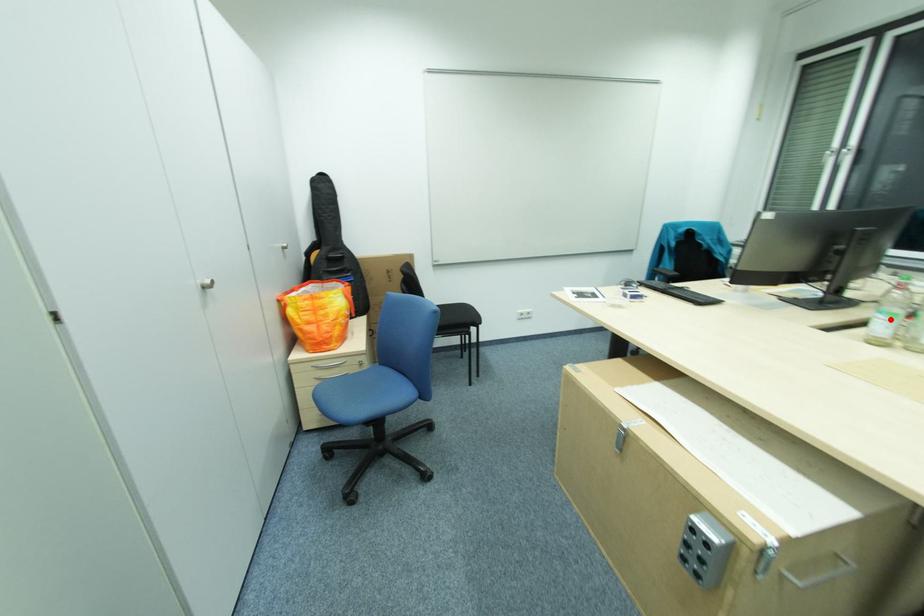
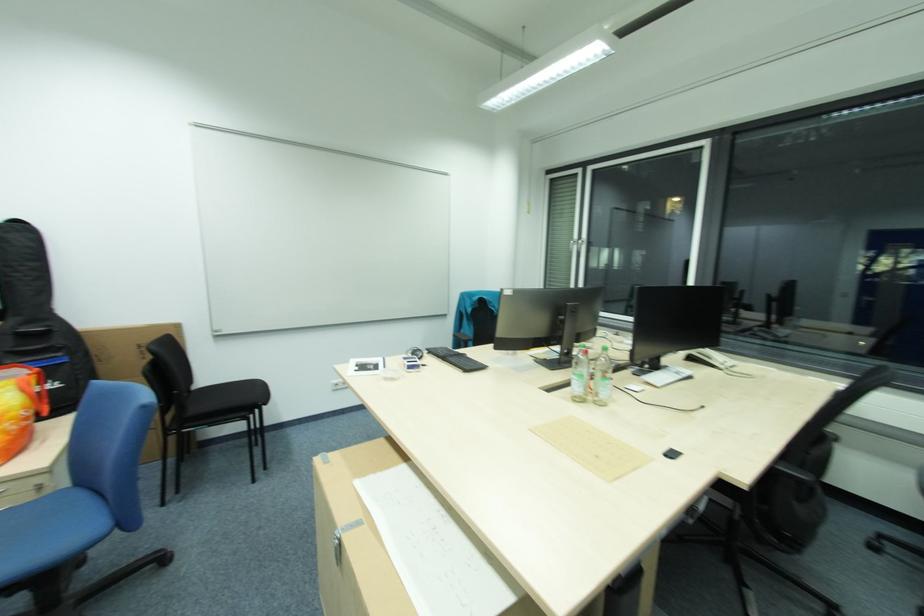
Where in the second image is the point corresponding to the highlighted location from the first image?

(588, 379)